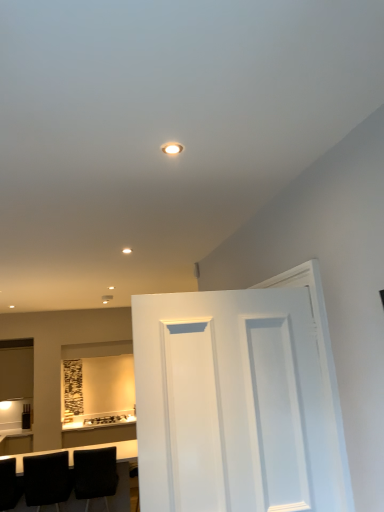
Question: Does black leather chair at lower left, the 2th chair positioned from the left, have a greater height compared to black leather table at lower left?

Choices:
 (A) yes
 (B) no

Answer: (B)

Question: From a real-world perspective, is black leather chair at lower left, positioned as the second chair in right-to-left order, on top of black leather table at lower left?

Choices:
 (A) no
 (B) yes

Answer: (B)

Question: Is black leather chair at lower left, positioned as the second chair in right-to-left order, bigger than black leather table at lower left?

Choices:
 (A) yes
 (B) no

Answer: (B)

Question: Is black leather chair at lower left, the 2th chair positioned from the left, completely or partially outside of black leather table at lower left?

Choices:
 (A) no
 (B) yes

Answer: (A)

Question: From the image's perspective, does black leather chair at lower left, the 2th chair positioned from the left, appear higher than black leather table at lower left?

Choices:
 (A) no
 (B) yes

Answer: (B)

Question: Considering the positions of black leather chair at lower left, the 2th chair positioned from the left, and white painted wood door at center in the image, is black leather chair at lower left, the 2th chair positioned from the left, taller or shorter than white painted wood door at center?

Choices:
 (A) short
 (B) tall

Answer: (A)

Question: Is black leather chair at lower left, positioned as the second chair in right-to-left order, spatially inside white painted wood door at center, or outside of it?

Choices:
 (A) inside
 (B) outside

Answer: (B)

Question: From the image's perspective, is black leather chair at lower left, the 2th chair positioned from the left, positioned above or below white painted wood door at center?

Choices:
 (A) below
 (B) above

Answer: (A)

Question: Considering the positions of black leather chair at lower left, positioned as the second chair in right-to-left order, and white painted wood door at center in the image, is black leather chair at lower left, positioned as the second chair in right-to-left order, bigger or smaller than white painted wood door at center?

Choices:
 (A) big
 (B) small

Answer: (B)

Question: Is black matte chair at lower left, the first chair when ordered from right to left, wider or thinner than black leather chair at lower left, the first chair in the left-to-right sequence?

Choices:
 (A) thin
 (B) wide

Answer: (A)

Question: From the image's perspective, is black matte chair at lower left, the 3th chair viewed from the left, located above or below black leather chair at lower left, the first chair in the left-to-right sequence?

Choices:
 (A) below
 (B) above

Answer: (A)

Question: Does point (102, 490) appear closer or farther from the camera than point (13, 487)?

Choices:
 (A) farther
 (B) closer

Answer: (A)

Question: Is black matte chair at lower left, the 3th chair viewed from the left, inside or outside of black leather chair at lower left, marked as the third chair in a right-to-left arrangement?

Choices:
 (A) inside
 (B) outside

Answer: (B)

Question: Does point (16, 468) appear closer or farther from the camera than point (122, 417)?

Choices:
 (A) closer
 (B) farther

Answer: (A)

Question: From a real-world perspective, is black leather table at lower left positioned above or below matte black toaster at lower center?

Choices:
 (A) below
 (B) above

Answer: (A)